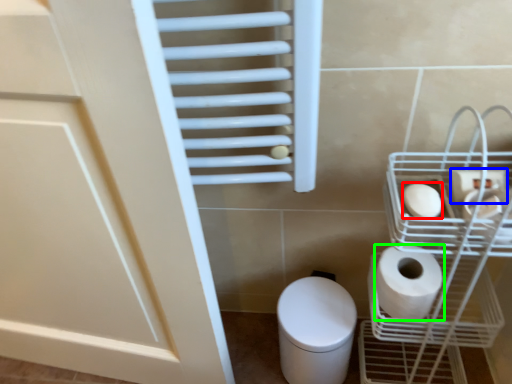
Question: Which is nearer to the toilet paper (highlighted by a red box)? toilet paper (highlighted by a blue box) or toilet paper (highlighted by a green box).

Choices:
 (A) toilet paper
 (B) toilet paper

Answer: (A)